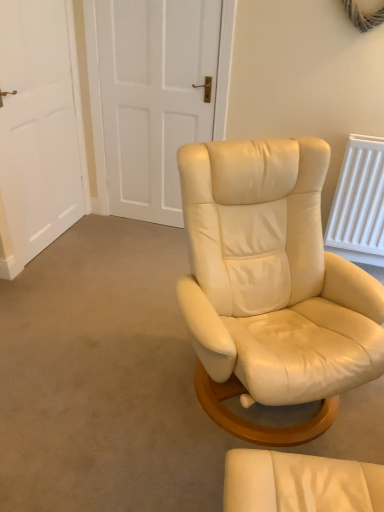
Question: Considering the positions of matte cream leather chair at center and white matte door at upper center, the first door positioned from the right, in the image, is matte cream leather chair at center wider or thinner than white matte door at upper center, the first door positioned from the right,?

Choices:
 (A) thin
 (B) wide

Answer: (B)

Question: Is matte cream leather chair at center inside or outside of white matte door at upper center, acting as the 2th door starting from the left?

Choices:
 (A) outside
 (B) inside

Answer: (A)

Question: Which object is positioned farthest from the matte cream leather chair at center?

Choices:
 (A) white matte door at upper center, acting as the 2th door starting from the left
 (B) white matte door at upper left, acting as the second door starting from the right

Answer: (A)

Question: Estimate the real-world distances between objects in this image. Which object is closer to the matte cream leather chair at center?

Choices:
 (A) white matte door at upper center, the first door positioned from the right
 (B) white matte door at upper left, acting as the second door starting from the right

Answer: (B)